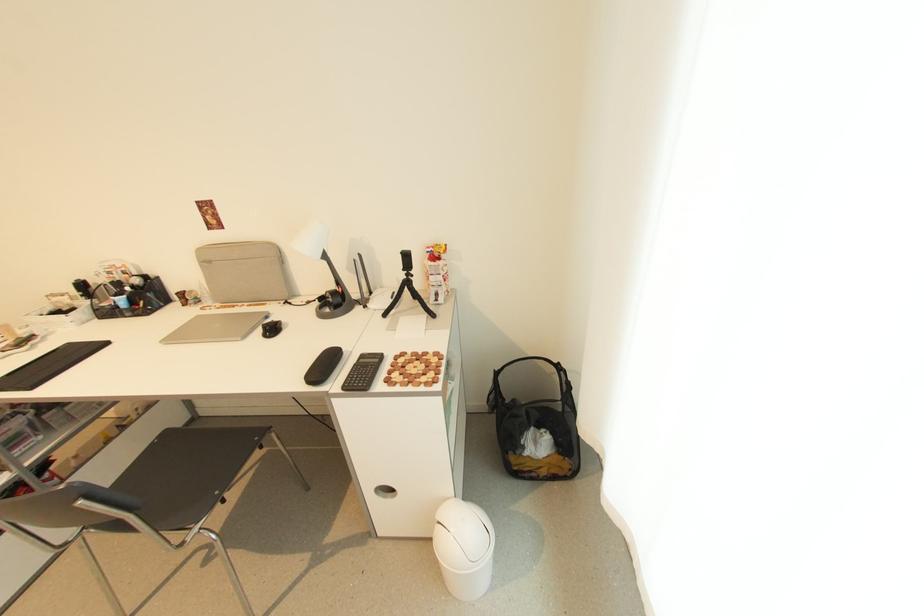
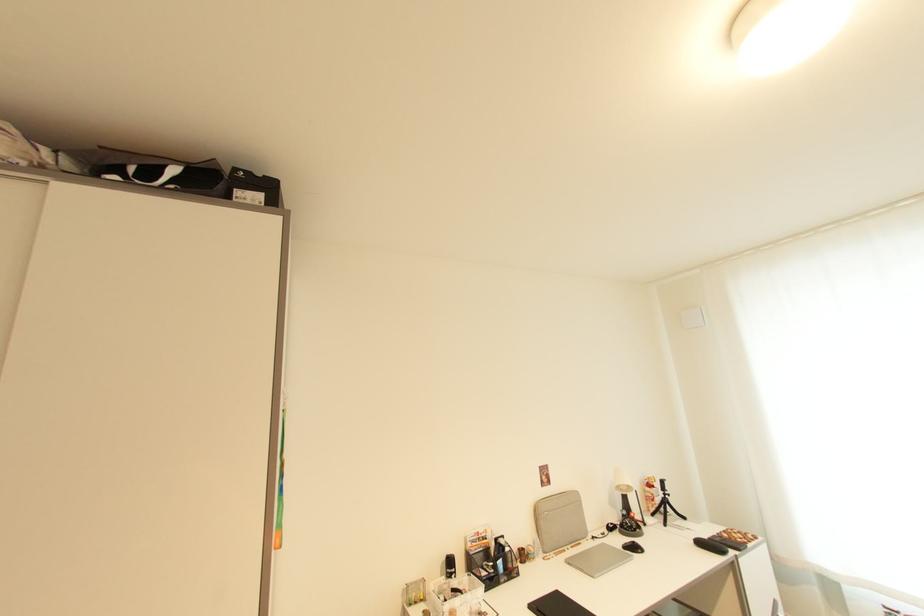
The point at (x=410, y=278) is marked in the first image. Where is the corresponding point in the second image?

(669, 498)